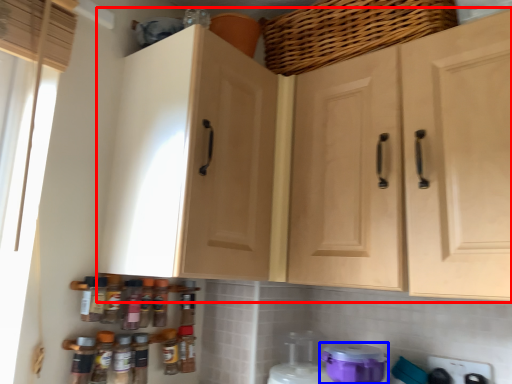
Question: Which of the following is the closest to the observer, cabinetry (highlighted by a red box) or appliance (highlighted by a blue box)?

Choices:
 (A) cabinetry
 (B) appliance

Answer: (A)